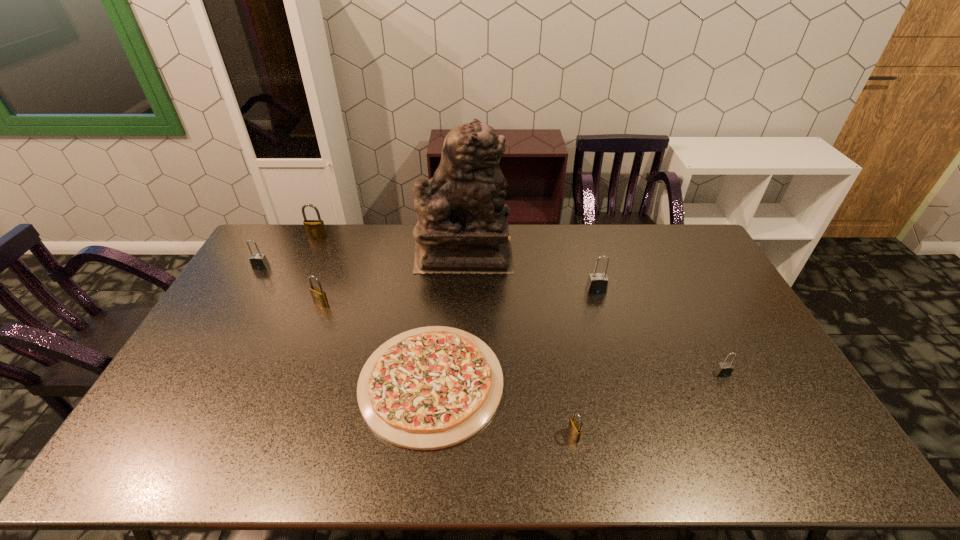
I want to click on sculpture, so 462,227.

Identify the location of the farthest brass padlock. (315, 229).

Where is `the second object from left to right`? The height and width of the screenshot is (540, 960). the second object from left to right is located at coordinates (315, 229).

Identify the location of the second gray padlock from left to right. The height and width of the screenshot is (540, 960). (597, 283).

The height and width of the screenshot is (540, 960). What are the coordinates of `the biggest gray padlock` in the screenshot? It's located at (597, 283).

Locate an element on the screen. The height and width of the screenshot is (540, 960). the leftmost padlock is located at coordinates (259, 261).

Find the location of a particular element. This screenshot has width=960, height=540. the leftmost object is located at coordinates (259, 261).

Locate an element on the screen. The height and width of the screenshot is (540, 960). the third nearest padlock is located at coordinates (319, 297).

The width and height of the screenshot is (960, 540). I want to click on the second brass padlock from left to right, so click(x=319, y=297).

You are a GUI agent. You are given a task and a screenshot of the screen. Output one action in this format:
    pyautogui.click(x=<x>, y=<y>)
    Task: Click on the rightmost gray padlock
    The height and width of the screenshot is (540, 960).
    Given the screenshot: What is the action you would take?
    pyautogui.click(x=724, y=369)